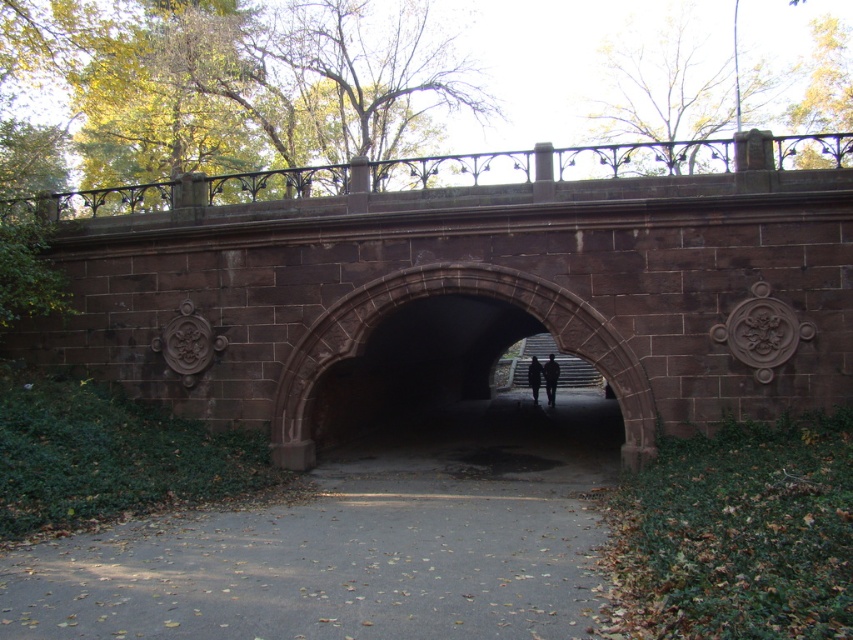
This screenshot has width=853, height=640. Describe the element at coordinates (462, 291) in the screenshot. I see `brown stone bridge at center` at that location.

Which is in front, point (97, 300) or point (553, 404)?

Point (97, 300) is in front.

This screenshot has width=853, height=640. Find the location of `brown stone bridge at center`. brown stone bridge at center is located at coordinates (462, 291).

Find the location of `gray asphalt path at center`. gray asphalt path at center is located at coordinates 357,541.

Where is `gray asphalt path at center`? gray asphalt path at center is located at coordinates (357, 541).

Is dark brown stone archway at center wider than black matte person at center?

No, dark brown stone archway at center is not wider than black matte person at center.

Who is positioned more to the left, dark brown stone archway at center or black matte person at center?

dark brown stone archway at center is more to the left.

Who is more forward, (x=440, y=288) or (x=532, y=378)?

Point (x=440, y=288) is more forward.

I want to click on dark brown stone archway at center, so click(457, 292).